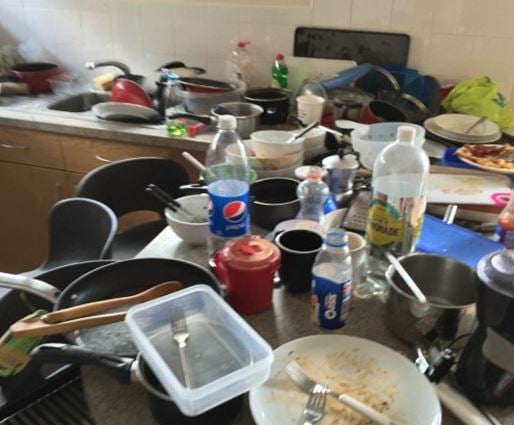
You are a GUI agent. You are given a task and a screenshot of the screen. Output one action in this format:
    pyautogui.click(x=<x>, y=<y>)
    Task: Click on the dirty pans
    This screenshot has height=425, width=514.
    Given the screenshot: What is the action you would take?
    pyautogui.click(x=405, y=303), pyautogui.click(x=273, y=96), pyautogui.click(x=255, y=118)